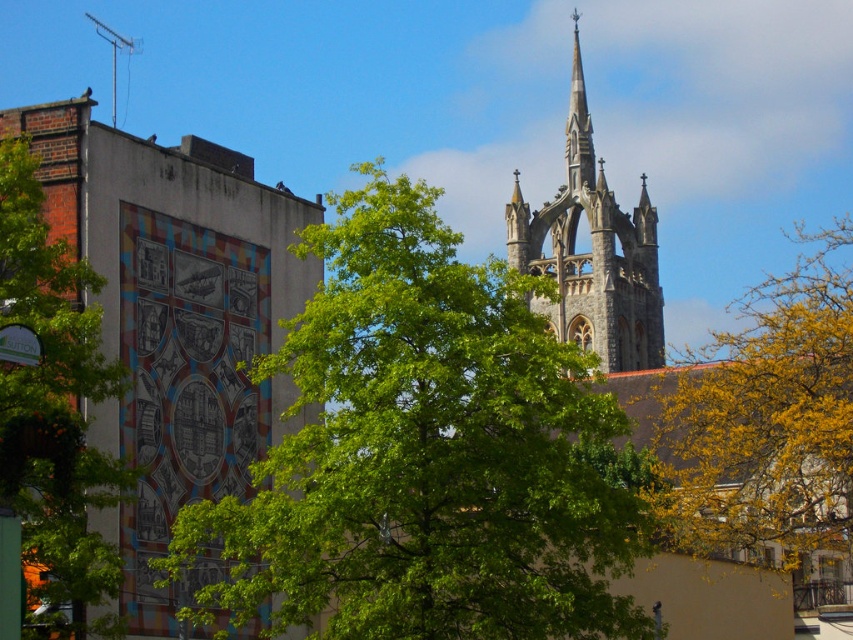
Question: Does green leafy tree at center lie behind yellow leafy tree at center?

Choices:
 (A) no
 (B) yes

Answer: (A)

Question: Which of the following is the farthest from the observer?

Choices:
 (A) (637, 241)
 (B) (795, 292)
 (C) (264, 481)

Answer: (A)

Question: Which object is the closest to the gray stone tower at upper center?

Choices:
 (A) green leafy tree at left
 (B) green leafy tree at center
 (C) yellow leafy tree at center

Answer: (C)

Question: Does green leafy tree at center come behind green leafy tree at left?

Choices:
 (A) yes
 (B) no

Answer: (A)

Question: Which point is farther from the camera taking this photo?

Choices:
 (A) (415, 573)
 (B) (682, 504)
 (C) (581, 332)

Answer: (C)

Question: Is yellow leafy tree at center bigger than green leafy tree at left?

Choices:
 (A) no
 (B) yes

Answer: (B)